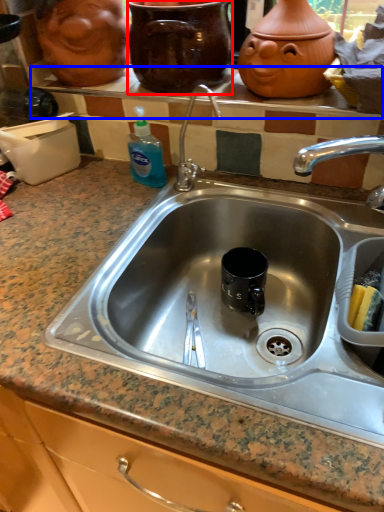
Question: Which object appears closest to the camera in this image, pottery (highlighted by a red box) or window sill (highlighted by a blue box)?

Choices:
 (A) pottery
 (B) window sill

Answer: (A)